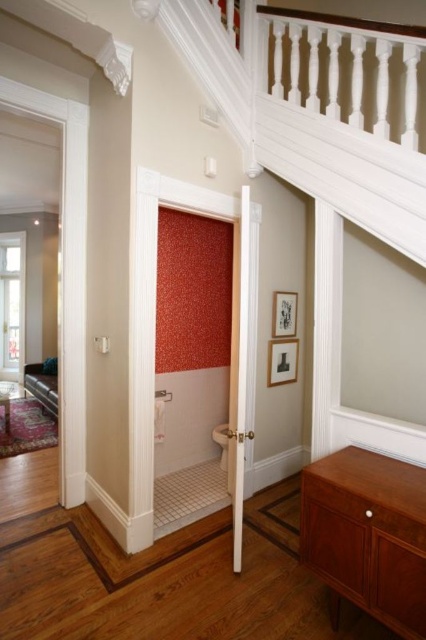
Who is taller, white textured stair at upper center or matte brown cabinet at lower right?

With more height is white textured stair at upper center.

Is white textured stair at upper center positioned in front of matte brown cabinet at lower right?

No, it is behind matte brown cabinet at lower right.

Where is `white textured stair at upper center`? The width and height of the screenshot is (426, 640). white textured stair at upper center is located at coordinates (319, 108).

Find the location of a particular element. The image size is (426, 640). white textured stair at upper center is located at coordinates (319, 108).